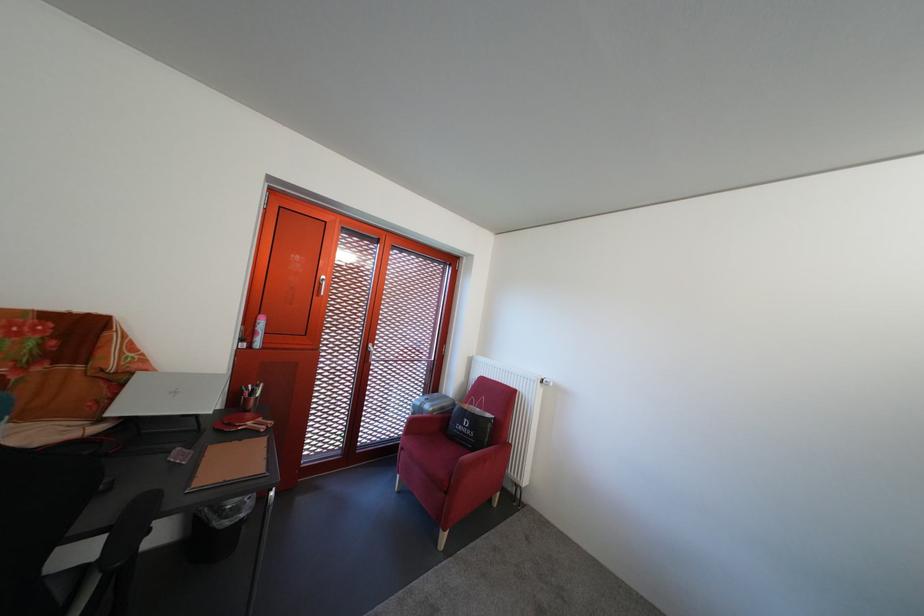
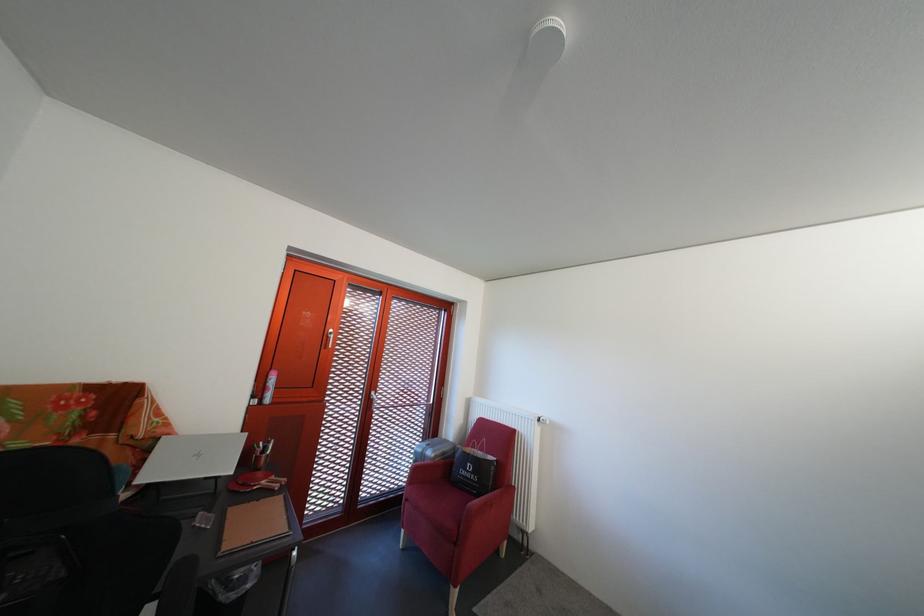
The point at (252, 346) is marked in the first image. Where is the corresponding point in the second image?

(263, 403)